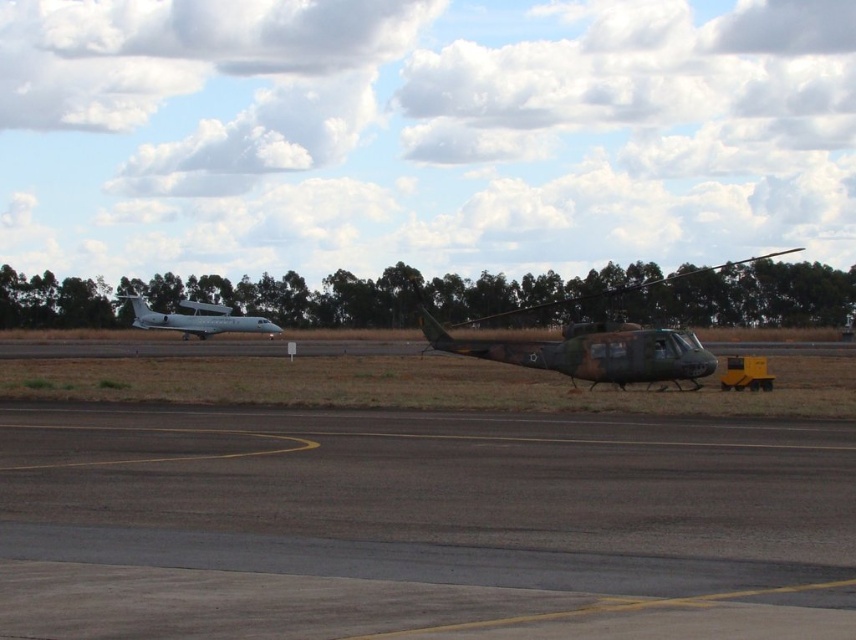
Question: Among these points, which one is nearest to the camera?

Choices:
 (A) (224, 328)
 (B) (593, 384)

Answer: (B)

Question: Which point appears closest to the camera in this image?

Choices:
 (A) (253, 477)
 (B) (197, 310)
 (C) (504, 312)

Answer: (A)

Question: Does camouflage paint helicopter at center have a smaller size compared to silver metallic airplane at left?

Choices:
 (A) yes
 (B) no

Answer: (B)

Question: Can you confirm if dark gray asphalt at center is wider than camouflage paint helicopter at center?

Choices:
 (A) no
 (B) yes

Answer: (A)

Question: Can you confirm if camouflage paint helicopter at center is wider than silver metallic airplane at left?

Choices:
 (A) no
 (B) yes

Answer: (B)

Question: Which point is closer to the camera?

Choices:
 (A) (183, 339)
 (B) (578, 344)

Answer: (B)